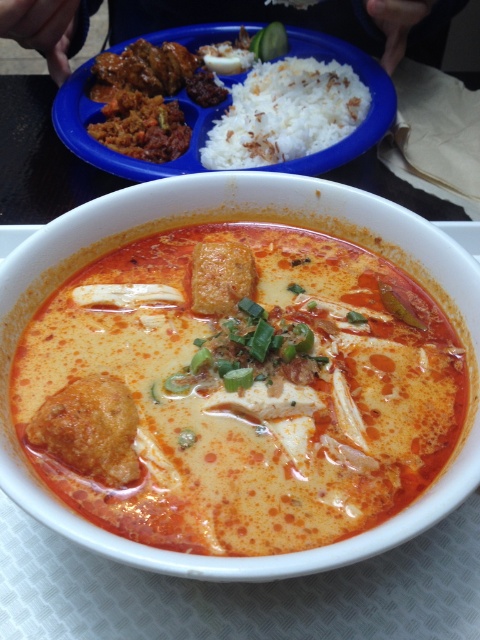
Question: Does white polished rice at upper center appear on the left side of brown crumbly meatball at center?

Choices:
 (A) no
 (B) yes

Answer: (A)

Question: Can you confirm if creamy orange soup at center is positioned to the left of white polished rice at upper center?

Choices:
 (A) no
 (B) yes

Answer: (B)

Question: Is creamy orange soup at center closer to camera compared to white polished rice at upper center?

Choices:
 (A) no
 (B) yes

Answer: (B)

Question: Among these objects, which one is farthest from the camera?

Choices:
 (A) creamy orange soup at center
 (B) brown crumbly meatball at center
 (C) white polished rice at upper center

Answer: (C)

Question: Which point is farther to the camera?

Choices:
 (A) creamy orange soup at center
 (B) white polished rice at upper center

Answer: (B)

Question: Which point is closer to the camera?

Choices:
 (A) (233, 484)
 (B) (227, 140)

Answer: (A)